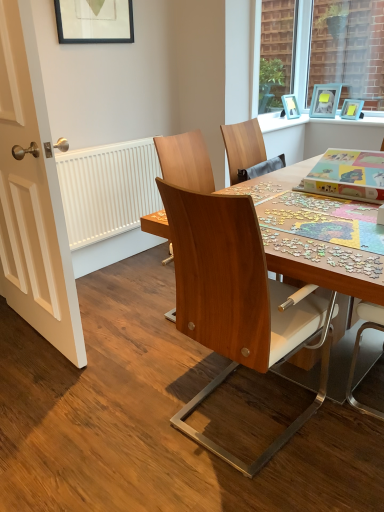
Where is `free point to the right of white painted wood door at left`? The height and width of the screenshot is (512, 384). free point to the right of white painted wood door at left is located at coordinates (132, 329).